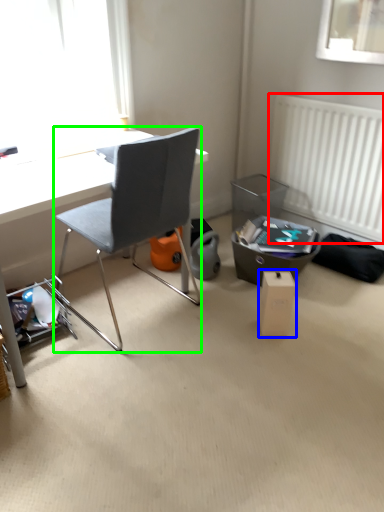
Question: Which object is positioned closest to radiator (highlighted by a red box)? Select from cardboard box (highlighted by a blue box) and chair (highlighted by a green box).

Choices:
 (A) cardboard box
 (B) chair

Answer: (A)